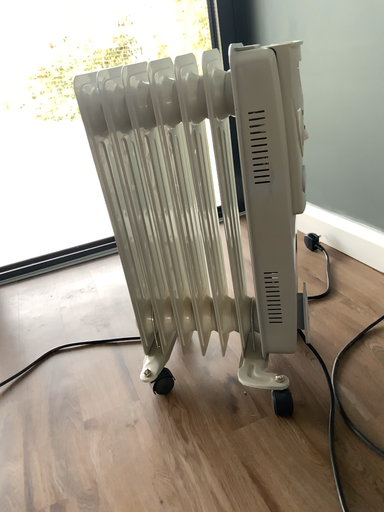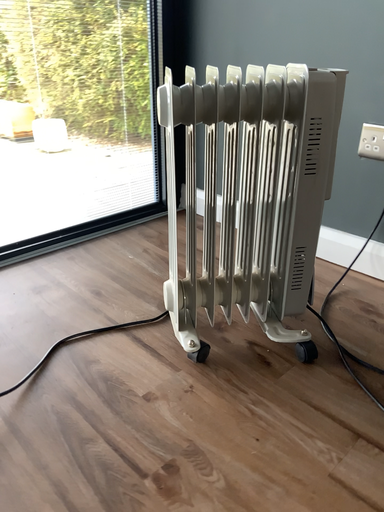
Question: Which way did the camera rotate in the video?

Choices:
 (A) rotated left
 (B) rotated right

Answer: (B)